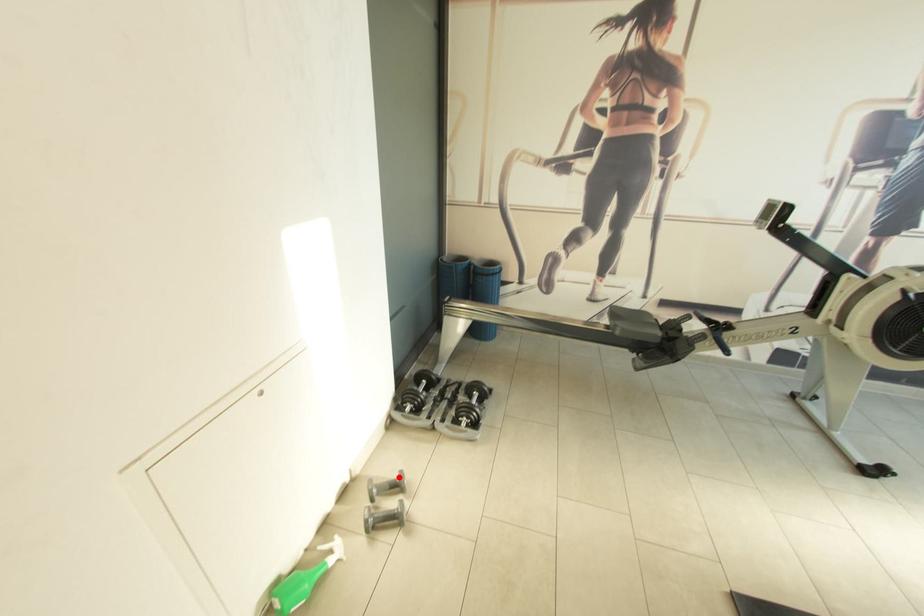
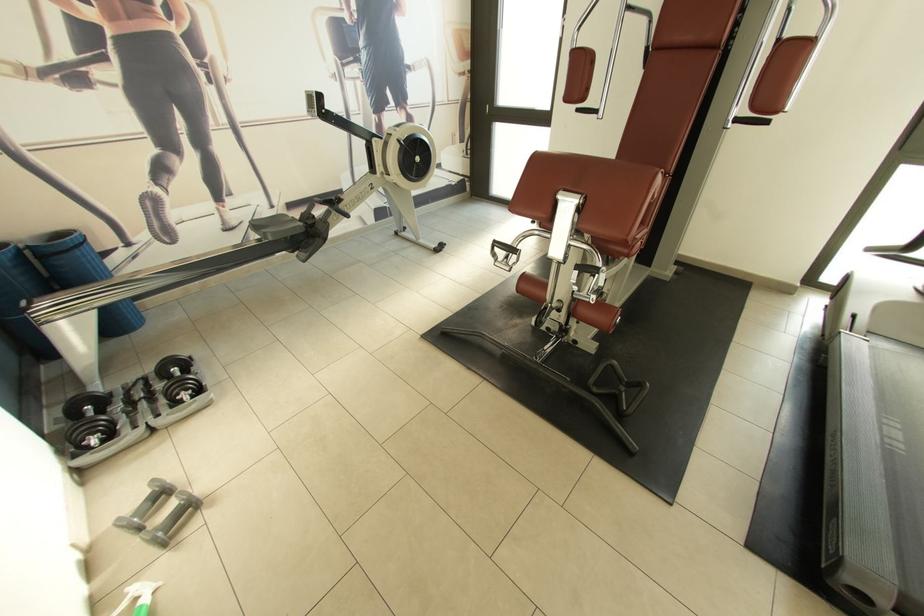
In the second image, find the point that corresponds to the highlighted location in the first image.

(152, 493)